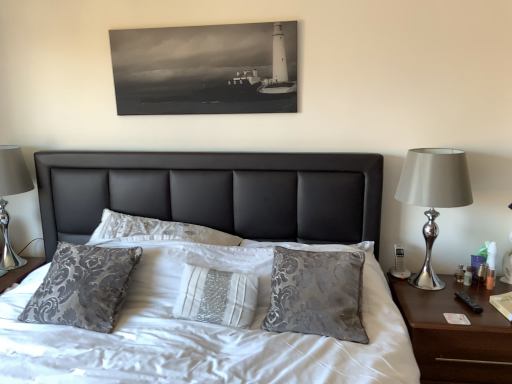
Where is `silver metallic lamp at right`? The image size is (512, 384). silver metallic lamp at right is located at coordinates (433, 196).

This screenshot has height=384, width=512. Find the location of `silver metallic lamp at right`. silver metallic lamp at right is located at coordinates (433, 196).

Is point (443, 344) closer to viewer compared to point (421, 171)?

Yes, point (443, 344) is in front of point (421, 171).

From a real-world perspective, which is physically below, brown wood nightstand at right or silver metallic lamp at right?

brown wood nightstand at right, from a real-world perspective.

From the image's perspective, is brown wood nightstand at right beneath silver metallic lamp at right?

Yes, from the image's perspective, brown wood nightstand at right is beneath silver metallic lamp at right.

Which object is positioned more to the right, silver metallic table lamp at left or brown wood nightstand at right?

From the viewer's perspective, brown wood nightstand at right appears more on the right side.

Which of these two, silver metallic table lamp at left or brown wood nightstand at right, is wider?

brown wood nightstand at right.

Is silver metallic table lamp at left oriented towards brown wood nightstand at right?

No, silver metallic table lamp at left is not aimed at brown wood nightstand at right.

From a real-world perspective, who is located higher, silver metallic table lamp at left or brown wood nightstand at right?

silver metallic table lamp at left, from a real-world perspective.

How much distance is there between silver metallic table lamp at left and silver metallic lamp at right?

A distance of 2.14 meters exists between silver metallic table lamp at left and silver metallic lamp at right.

Considering the points (6, 216) and (464, 167), which point is in front, point (6, 216) or point (464, 167)?

Point (464, 167)

Considering the relative sizes of silver metallic table lamp at left and silver metallic lamp at right in the image provided, is silver metallic table lamp at left taller than silver metallic lamp at right?

No, silver metallic table lamp at left is not taller than silver metallic lamp at right.

The width and height of the screenshot is (512, 384). In the image, there is a silver metallic lamp at right. Identify the location of table lamp below it (from a real-world perspective). (11, 194).

Considering the relative positions of silver metallic lamp at right and silver metallic table lamp at left in the image provided, is silver metallic lamp at right behind silver metallic table lamp at left?

No, it is not.

Which is further, (x=424, y=187) or (x=1, y=189)?

The point (x=1, y=189) is more distant.

Is brown wood nightstand at right outside of silver metallic table lamp at left?

Absolutely, brown wood nightstand at right is external to silver metallic table lamp at left.

Is brown wood nightstand at right with silver metallic table lamp at left?

They are not placed beside each other.

From the image's perspective, is brown wood nightstand at right above or below silver metallic table lamp at left?

brown wood nightstand at right is below silver metallic table lamp at left.

Does brown wood nightstand at right turn towards silver metallic table lamp at left?

No, brown wood nightstand at right is not facing towards silver metallic table lamp at left.

Looking at this image, choose the correct answer: Is silver metallic lamp at right inside brown wood nightstand at right or outside it?

silver metallic lamp at right is not inside brown wood nightstand at right, it's outside.

The image size is (512, 384). Find the location of `nightstand that is under the silver metallic lamp at right (from a real-world perspective)`. nightstand that is under the silver metallic lamp at right (from a real-world perspective) is located at coordinates (455, 333).

Does silver metallic lamp at right have a lesser height compared to brown wood nightstand at right?

No, silver metallic lamp at right is not shorter than brown wood nightstand at right.

How far apart are silver metallic lamp at right and brown wood nightstand at right?

silver metallic lamp at right and brown wood nightstand at right are 13.71 inches apart from each other.

Where is `nightstand below the silver metallic lamp at right (from the image's perspective)`? nightstand below the silver metallic lamp at right (from the image's perspective) is located at coordinates (455, 333).

This screenshot has height=384, width=512. I want to click on table lamp that appears behind the brown wood nightstand at right, so click(11, 194).

Which object lies nearer to the anchor point brown wood nightstand at right, silver metallic table lamp at left or silver metallic lamp at right?

Based on the image, silver metallic lamp at right appears to be nearer to brown wood nightstand at right.

Considering their positions, is silver metallic lamp at right positioned closer to brown wood nightstand at right than silver metallic table lamp at left?

silver metallic lamp at right is positioned closer to the anchor brown wood nightstand at right.

Based on their spatial positions, is silver metallic table lamp at left or brown wood nightstand at right further from silver metallic lamp at right?

silver metallic table lamp at left.

Looking at the image, which one is located closer to silver metallic table lamp at left, brown wood nightstand at right or silver metallic lamp at right?

silver metallic lamp at right lies closer to silver metallic table lamp at left than the other object.

Based on their spatial positions, is silver metallic lamp at right or brown wood nightstand at right further from silver metallic table lamp at left?

Among the two, brown wood nightstand at right is located further to silver metallic table lamp at left.

From the image, which object appears to be nearer to silver metallic lamp at right, brown wood nightstand at right or silver metallic table lamp at left?

Among the two, brown wood nightstand at right is located nearer to silver metallic lamp at right.

This screenshot has height=384, width=512. What are the coordinates of `bedside lamp between silver metallic table lamp at left and brown wood nightstand at right from left to right` in the screenshot? It's located at (433, 196).